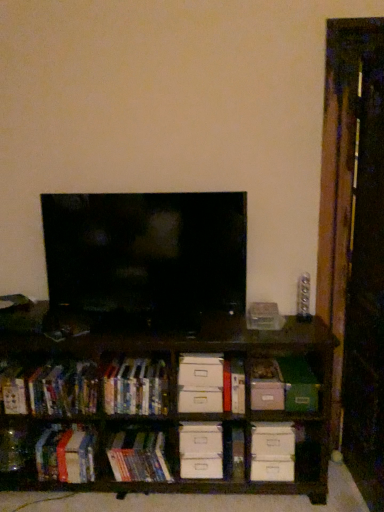
Identify the location of vacant space in matte black tv at center (from a real-world perspective). The width and height of the screenshot is (384, 512). (147, 329).